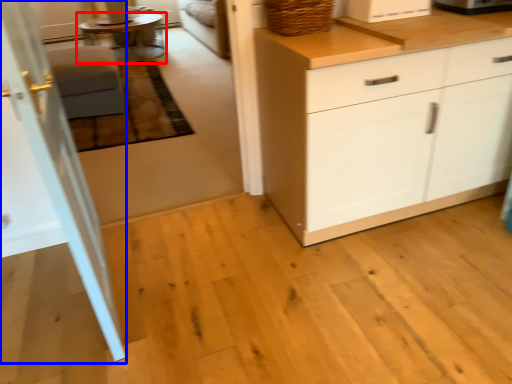
Question: Which of the following is the farthest to the observer, table (highlighted by a red box) or screen door (highlighted by a blue box)?

Choices:
 (A) table
 (B) screen door

Answer: (A)